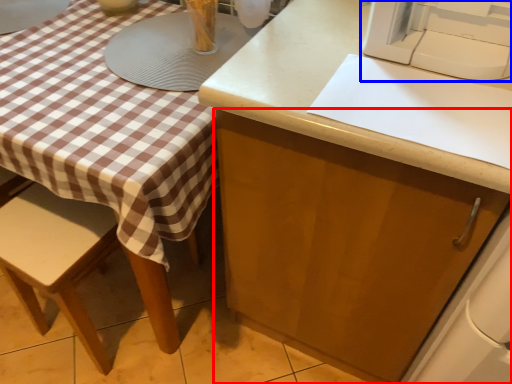
Question: Which of the following is the closest to the observer, cabinetry (highlighted by a red box) or sewing machine (highlighted by a blue box)?

Choices:
 (A) cabinetry
 (B) sewing machine

Answer: (A)